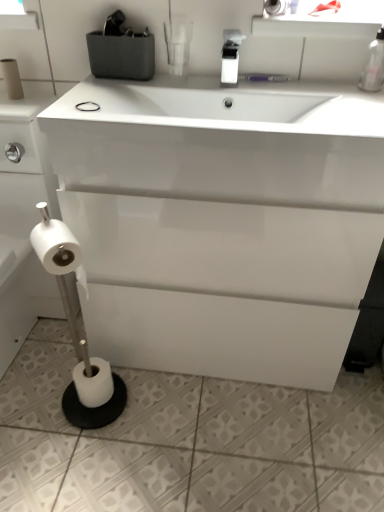
Question: Is black rubber band at upper center far from white matte toilet paper at left, which is counted as the 4th toilet paper, starting from the right?

Choices:
 (A) no
 (B) yes

Answer: (A)

Question: From a real-world perspective, is black rubber band at upper center below white matte toilet paper at left, the 3th toilet paper ordered from the bottom?

Choices:
 (A) no
 (B) yes

Answer: (A)

Question: Is black rubber band at upper center to the left of white matte toilet paper at left, which is counted as the 1th toilet paper, starting from the left, from the viewer's perspective?

Choices:
 (A) no
 (B) yes

Answer: (A)

Question: Can white matte toilet paper at left, which is counted as the 1th toilet paper, starting from the left, be found inside black rubber band at upper center?

Choices:
 (A) no
 (B) yes

Answer: (A)

Question: Considering the relative sizes of black rubber band at upper center and white matte toilet paper at left, which is counted as the 1th toilet paper, starting from the left, in the image provided, is black rubber band at upper center shorter than white matte toilet paper at left, which is counted as the 1th toilet paper, starting from the left,?

Choices:
 (A) no
 (B) yes

Answer: (B)

Question: Based on their positions, is white matte toilet paper at upper center, the 4th toilet paper positioned from the left, located to the left or right of white glossy soap dispenser at upper center, which is counted as the 1th bottle, starting from the left?

Choices:
 (A) left
 (B) right

Answer: (B)

Question: Is white matte toilet paper at upper center, the 1th toilet paper positioned from the top, bigger or smaller than white glossy soap dispenser at upper center, which is counted as the 1th bottle, starting from the left?

Choices:
 (A) small
 (B) big

Answer: (A)

Question: Relative to white glossy soap dispenser at upper center, the 2th bottle in the right-to-left sequence, is white matte toilet paper at upper center, the fourth toilet paper from the bottom, in front or behind?

Choices:
 (A) behind
 (B) front

Answer: (A)

Question: Is point (266, 12) closer or farther from the camera than point (231, 64)?

Choices:
 (A) farther
 (B) closer

Answer: (B)

Question: Is white matte toilet paper at lower left, the second toilet paper viewed from the left, taller or shorter than white glossy soap dispenser at upper center, the 2th bottle in the right-to-left sequence?

Choices:
 (A) tall
 (B) short

Answer: (A)

Question: From a real-world perspective, is white matte toilet paper at lower left, placed as the 2th toilet paper when sorted from bottom to top, above or below white glossy soap dispenser at upper center, the 2th bottle in the right-to-left sequence?

Choices:
 (A) above
 (B) below

Answer: (B)

Question: Is white matte toilet paper at lower left, the second toilet paper viewed from the left, inside or outside of white glossy soap dispenser at upper center, which is counted as the 1th bottle, starting from the left?

Choices:
 (A) outside
 (B) inside

Answer: (A)

Question: Is white matte toilet paper at lower left, placed as the 2th toilet paper when sorted from bottom to top, in front of or behind white glossy soap dispenser at upper center, which is counted as the 1th bottle, starting from the left, in the image?

Choices:
 (A) front
 (B) behind

Answer: (A)

Question: From the image's perspective, relative to black rubber band at upper center, is white matte toilet paper at upper center, the fourth toilet paper from the bottom, above or below?

Choices:
 (A) above
 (B) below

Answer: (A)

Question: In terms of height, does white matte toilet paper at upper center, the first toilet paper when ordered from right to left, look taller or shorter compared to black rubber band at upper center?

Choices:
 (A) tall
 (B) short

Answer: (A)